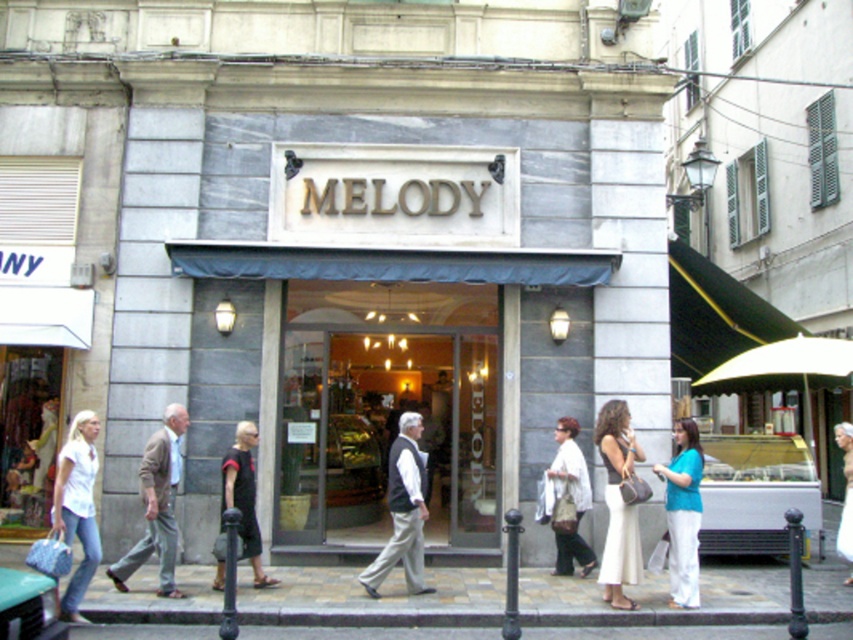
Question: Which of the following is the closest to the observer?

Choices:
 (A) (163, 486)
 (B) (241, 508)

Answer: (A)

Question: Which point is farther to the camera?

Choices:
 (A) (676, 452)
 (B) (83, 582)
 (C) (403, 465)

Answer: (A)

Question: Is white cotton pants at center to the right of light beige dress at center from the viewer's perspective?

Choices:
 (A) yes
 (B) no

Answer: (B)

Question: Is white cotton pants at center closer to the viewer compared to gray wool vest at center?

Choices:
 (A) no
 (B) yes

Answer: (B)

Question: Is white matte shirt at left to the left of white cotton blouse at center from the viewer's perspective?

Choices:
 (A) no
 (B) yes

Answer: (B)

Question: Based on their relative distances, which object is nearer to the gray wool vest at center?

Choices:
 (A) light brown fabric suit at left
 (B) teal fabric blouse at lower right
 (C) light beige dress at center
 (D) white matte shirt at left

Answer: (A)